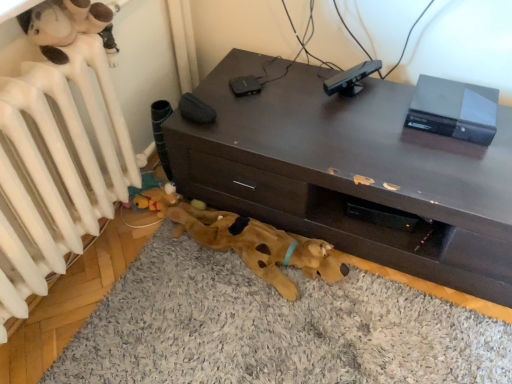
This screenshot has width=512, height=384. Describe the element at coordinates (351, 79) in the screenshot. I see `black matte sensor at upper center` at that location.

The height and width of the screenshot is (384, 512). In order to click on white matte radiator at upper left in this screenshot , I will do `click(54, 173)`.

Consider the image. What is the approximate width of brown plush dog bed at lower center?

4.21 feet.

What are the coordinates of `dark brown wood desk at center` in the screenshot? It's located at (352, 173).

At what (x,y) coordinates should I click in order to perform the action: click on radiator in front of the black matte sensor at upper center. Please return your answer as a coordinate pair (x, y). The image size is (512, 384). Looking at the image, I should click on (54, 173).

From the picture: Could you tell me if white matte radiator at upper left is turned towards black matte sensor at upper center?

No.

Between white matte radiator at upper left and black matte sensor at upper center, which one appears on the right side from the viewer's perspective?

Positioned to the right is black matte sensor at upper center.

Measure the distance between brown plush dog bed at lower center and black matte sensor at upper center.

33.98 inches.

Is the position of brown plush dog bed at lower center more distant than that of black matte sensor at upper center?

No.

Identify the location of dog bed directly beneath the black matte sensor at upper center (from a real-world perspective). (273, 328).

Do you think brown plush dog bed at lower center is within black matte sensor at upper center, or outside of it?

brown plush dog bed at lower center exists outside the volume of black matte sensor at upper center.

Considering the relative sizes of brown plush dog at lower center and dark brown wood desk at center in the image provided, is brown plush dog at lower center smaller than dark brown wood desk at center?

Indeed, brown plush dog at lower center has a smaller size compared to dark brown wood desk at center.

From a real-world perspective, does brown plush dog at lower center sit lower than dark brown wood desk at center?

Correct, in the physical world, brown plush dog at lower center is lower than dark brown wood desk at center.

Where is `desk that appears above the brown plush dog at lower center (from a real-world perspective)`? desk that appears above the brown plush dog at lower center (from a real-world perspective) is located at coordinates (352, 173).

Would you say dark brown wood desk at center is part of brown plush dog at lower center's contents?

No, dark brown wood desk at center is not a part of brown plush dog at lower center.

Is brown plush dog at lower center facing away from white matte radiator at upper left?

No, brown plush dog at lower center is not facing away from white matte radiator at upper left.

Considering their positions, is brown plush dog at lower center located in front of or behind white matte radiator at upper left?

Visually, brown plush dog at lower center is located behind white matte radiator at upper left.

Measure the distance from brown plush dog at lower center to white matte radiator at upper left.

20.16 inches.

Is point (280, 292) closer or farther from the camera than point (9, 135)?

Point (280, 292).

Between black matte sensor at upper center and white matte radiator at upper left, which one has smaller size?

black matte sensor at upper center is smaller.

Which of these two, black matte sensor at upper center or white matte radiator at upper left, is wider?

Wider between the two is white matte radiator at upper left.

From a real-world perspective, which object stands above the other?

black matte sensor at upper center, from a real-world perspective.

From the picture: Can you confirm if white matte radiator at upper left is positioned to the right of dark brown wood desk at center?

No, white matte radiator at upper left is not to the right of dark brown wood desk at center.

Locate an element on the screen. desk above the white matte radiator at upper left (from the image's perspective) is located at coordinates (352, 173).

Does white matte radiator at upper left contain dark brown wood desk at center?

Definitely not — dark brown wood desk at center is not inside white matte radiator at upper left.

From the image's perspective, which one is positioned higher, white matte radiator at upper left or dark brown wood desk at center?

dark brown wood desk at center.

Which object is closer to the camera, brown plush dog bed at lower center or white matte radiator at upper left?

white matte radiator at upper left is more forward.

Is brown plush dog bed at lower center shorter than white matte radiator at upper left?

Indeed, brown plush dog bed at lower center has a lesser height compared to white matte radiator at upper left.

Looking at this image, does brown plush dog bed at lower center touch white matte radiator at upper left?

There is a gap between brown plush dog bed at lower center and white matte radiator at upper left.

From the picture: Is white matte radiator at upper left at the back of brown plush dog bed at lower center?

No.

Locate an element on the screen. Image resolution: width=512 pixels, height=384 pixels. equipment that is behind the white matte radiator at upper left is located at coordinates (351, 79).

This screenshot has height=384, width=512. In order to click on dog bed in front of the black matte sensor at upper center in this screenshot , I will do `click(273, 328)`.

When comparing their distances from brown plush dog bed at lower center, does white matte radiator at upper left or brown plush dog at lower center seem closer?

brown plush dog at lower center is positioned closer to the anchor brown plush dog bed at lower center.

Which object lies further to the anchor point black matte sensor at upper center, dark brown wood desk at center or white matte radiator at upper left?

Among the two, white matte radiator at upper left is located further to black matte sensor at upper center.

Estimate the real-world distances between objects in this image. Which object is closer to brown plush dog at lower center, brown plush dog bed at lower center or white matte radiator at upper left?

brown plush dog bed at lower center.

Based on their spatial positions, is white matte radiator at upper left or brown plush dog at lower center further from dark brown wood desk at center?

Based on the image, white matte radiator at upper left appears to be further to dark brown wood desk at center.

From the image, which object appears to be farther from white matte radiator at upper left, brown plush dog at lower center or dark brown wood desk at center?

dark brown wood desk at center.

Estimate the real-world distances between objects in this image. Which object is closer to brown plush dog bed at lower center, black matte sensor at upper center or dark brown wood desk at center?

The object closer to brown plush dog bed at lower center is dark brown wood desk at center.

Considering their positions, is brown plush dog at lower center positioned closer to black matte sensor at upper center than brown plush dog bed at lower center?

brown plush dog at lower center is closer to black matte sensor at upper center.

Which object lies nearer to the anchor point white matte radiator at upper left, brown plush dog bed at lower center or black matte sensor at upper center?

brown plush dog bed at lower center lies closer to white matte radiator at upper left than the other object.

At what (x,y) coordinates should I click in order to perform the action: click on dog bed situated between white matte radiator at upper left and dark brown wood desk at center from left to right. Please return your answer as a coordinate pair (x, y). Looking at the image, I should click on (x=273, y=328).

Where is `equipment between white matte radiator at upper left and dark brown wood desk at center`? equipment between white matte radiator at upper left and dark brown wood desk at center is located at coordinates (351, 79).

The image size is (512, 384). I want to click on dog bed located between white matte radiator at upper left and black matte sensor at upper center in the left-right direction, so click(x=273, y=328).

This screenshot has height=384, width=512. In order to click on desk between black matte sensor at upper center and brown plush dog at lower center from top to bottom in this screenshot , I will do (352, 173).